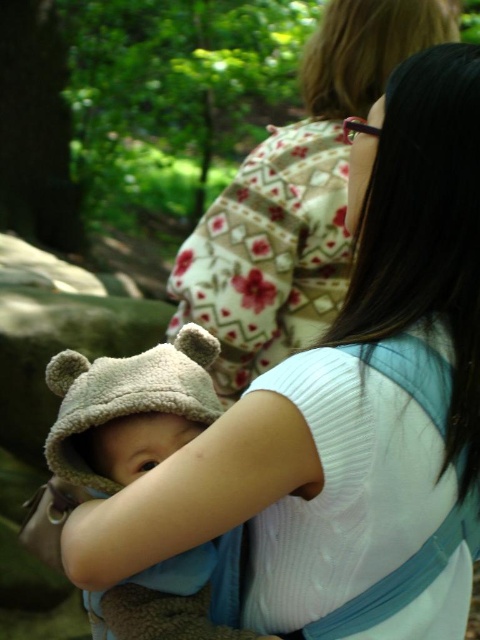
Does point (310, 61) come behind point (141, 413)?

Yes, point (310, 61) is farther from viewer.

Does floral fabric kimono at upper center appear on the left side of soft beige hat at center?

No, floral fabric kimono at upper center is not to the left of soft beige hat at center.

Image resolution: width=480 pixels, height=640 pixels. What are the coordinates of `floral fabric kimono at upper center` in the screenshot? It's located at (296, 198).